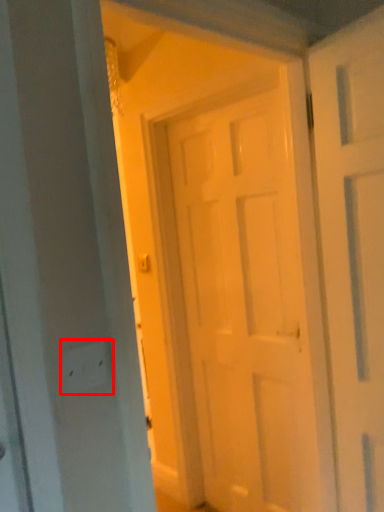
Question: From the image's perspective, what is the correct spatial positioning of electric outlet (annotated by the red box) in reference to door?

Choices:
 (A) below
 (B) above

Answer: (B)